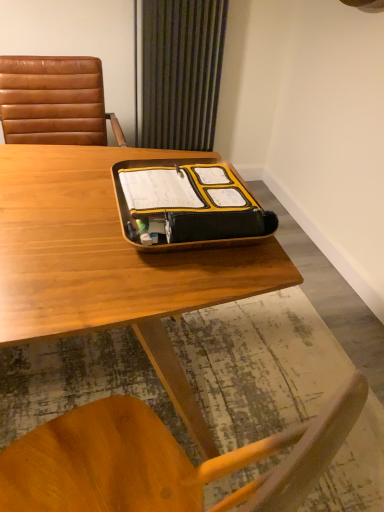
The image size is (384, 512). What do you see at coordinates (110, 262) in the screenshot? I see `wooden desk at center` at bounding box center [110, 262].

Measure the distance between point (194, 169) and camera.

Point (194, 169) and camera are 3.97 feet apart.

The image size is (384, 512). Describe the element at coordinates (54, 101) in the screenshot. I see `brown leather chair at left` at that location.

The image size is (384, 512). What are the coordinates of `green striped curtain at upper center` in the screenshot? It's located at (178, 72).

Between yellow matte tray at center and brown leather chair at left, which one has less height?

yellow matte tray at center is shorter.

Is yellow matte tray at center positioned far away from brown leather chair at left?

yellow matte tray at center is actually quite close to brown leather chair at left.

Looking at their sizes, would you say yellow matte tray at center is wider or thinner than brown leather chair at left?

Considering their sizes, yellow matte tray at center looks slimmer than brown leather chair at left.

The image size is (384, 512). Find the location of `chair behind the yellow matte tray at center`. chair behind the yellow matte tray at center is located at coordinates (54, 101).

From the picture: Is green striped curtain at upper center outside of brown leather chair at left?

Yes.

From the image's perspective, between green striped curtain at upper center and brown leather chair at left, which one is located above?

green striped curtain at upper center appears higher in the image.

You are a GUI agent. You are given a task and a screenshot of the screen. Output one action in this format:
    pyautogui.click(x=<x>, y=<y>)
    Task: Click on the curtain that is behind the brown leather chair at left
    
    Given the screenshot: What is the action you would take?
    pyautogui.click(x=178, y=72)

Is green striped curtain at upper center not near brown leather chair at left?

No, there isn't a large distance between green striped curtain at upper center and brown leather chair at left.

Is green striped curtain at upper center a part of yellow matte tray at center?

That's incorrect, green striped curtain at upper center is not inside yellow matte tray at center.

In terms of height, does yellow matte tray at center look taller or shorter compared to green striped curtain at upper center?

yellow matte tray at center is shorter than green striped curtain at upper center.

Which is more to the left, yellow matte tray at center or green striped curtain at upper center?

From the viewer's perspective, green striped curtain at upper center appears more on the left side.

Is yellow matte tray at center turned away from green striped curtain at upper center?

Yes, green striped curtain at upper center is at the back of yellow matte tray at center.

Does wooden desk at center come behind green striped curtain at upper center?

No, wooden desk at center is closer to the viewer.

You are a GUI agent. You are given a task and a screenshot of the screen. Output one action in this format:
    pyautogui.click(x=<x>, y=<y>)
    Task: Click on the desk in front of the green striped curtain at upper center
    The width and height of the screenshot is (384, 512).
    Given the screenshot: What is the action you would take?
    pyautogui.click(x=110, y=262)

Does wooden desk at center contain green striped curtain at upper center?

No, green striped curtain at upper center is not a part of wooden desk at center.

Considering the sizes of objects wooden desk at center and green striped curtain at upper center in the image provided, who is wider, wooden desk at center or green striped curtain at upper center?

Wider between the two is wooden desk at center.

Is brown leather chair at left in front of or behind green striped curtain at upper center in the image?

brown leather chair at left is in front of green striped curtain at upper center.

Which point is more distant from viewer, (48, 99) or (180, 29)?

The point (180, 29) is farther from the camera.

The image size is (384, 512). I want to click on chair below the green striped curtain at upper center (from the image's perspective), so click(54, 101).

Which of these two, brown leather chair at left or green striped curtain at upper center, stands taller?

green striped curtain at upper center is taller.

Considering the sizes of brown leather chair at left and yellow matte tray at center in the image, is brown leather chair at left bigger or smaller than yellow matte tray at center?

Clearly, brown leather chair at left is larger in size than yellow matte tray at center.

Is brown leather chair at left not near yellow matte tray at center?

No, brown leather chair at left is in close proximity to yellow matte tray at center.

Between brown leather chair at left and yellow matte tray at center, which one is positioned in front?

Positioned in front is yellow matte tray at center.

From the picture: Could you tell me if brown leather chair at left is turned towards wooden desk at center?

Yes, brown leather chair at left faces towards wooden desk at center.

Can you confirm if brown leather chair at left is positioned to the right of wooden desk at center?

No, brown leather chair at left is not to the right of wooden desk at center.

Does brown leather chair at left have a greater width compared to wooden desk at center?

In fact, brown leather chair at left might be narrower than wooden desk at center.

Locate an element on the screen. The height and width of the screenshot is (512, 384). chair that appears above the yellow matte tray at center (from the image's perspective) is located at coordinates (54, 101).

Locate an element on the screen. curtain above the brown leather chair at left (from a real-world perspective) is located at coordinates (178, 72).

Which object lies nearer to the anchor point brown leather chair at left, yellow matte tray at center or green striped curtain at upper center?

green striped curtain at upper center is closer to brown leather chair at left.

Looking at the image, which one is located further to brown leather chair at left, wooden desk at center or yellow matte tray at center?

yellow matte tray at center is positioned further to the anchor brown leather chair at left.

Based on the photo, considering their positions, is green striped curtain at upper center positioned closer to yellow matte tray at center than wooden desk at center?

wooden desk at center lies closer to yellow matte tray at center than the other object.

Looking at the image, which one is located closer to brown leather chair at left, green striped curtain at upper center or yellow matte tray at center?

green striped curtain at upper center.

Looking at the image, which one is located closer to green striped curtain at upper center, brown leather chair at left or wooden desk at center?

brown leather chair at left.

From the image, which object appears to be nearer to green striped curtain at upper center, yellow matte tray at center or wooden desk at center?

Based on the image, wooden desk at center appears to be nearer to green striped curtain at upper center.

Looking at the image, which one is located further to wooden desk at center, brown leather chair at left or green striped curtain at upper center?

Based on the image, green striped curtain at upper center appears to be further to wooden desk at center.

Based on their spatial positions, is brown leather chair at left or green striped curtain at upper center further from yellow matte tray at center?

green striped curtain at upper center is positioned further to the anchor yellow matte tray at center.

The height and width of the screenshot is (512, 384). What are the coordinates of `tray located between wooden desk at center and green striped curtain at upper center in the depth direction` in the screenshot? It's located at (187, 204).

Locate an element on the screen. The image size is (384, 512). chair positioned between yellow matte tray at center and green striped curtain at upper center from near to far is located at coordinates (54, 101).

This screenshot has width=384, height=512. Identify the location of tray between brown leather chair at left and wooden desk at center in the up-down direction. (187, 204).

Locate an element on the screen. Image resolution: width=384 pixels, height=512 pixels. chair between wooden desk at center and green striped curtain at upper center in the front-back direction is located at coordinates (54, 101).